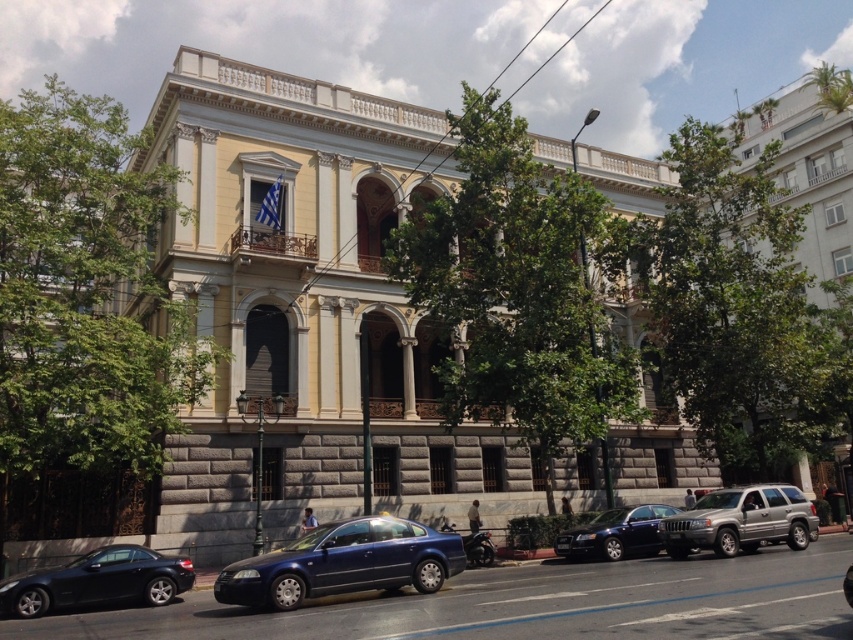
In the scene shown: Can you confirm if shiny black car at lower left is wider than shiny black sedan at center?

No.

Who is positioned more to the left, shiny black car at lower left or shiny black sedan at center?

From the viewer's perspective, shiny black car at lower left appears more on the left side.

Looking at this image, who is more forward, (68,602) or (596,550)?

Point (68,602) is in front.

Find the location of a particular element. This screenshot has height=640, width=853. shiny black car at lower left is located at coordinates (97, 580).

Who is lower down, shiny black car at lower left or silver metallic suv at center?

shiny black car at lower left

Does point (25, 572) lie in front of point (747, 490)?

Yes, point (25, 572) is in front of point (747, 490).

Identify the location of shiny black car at lower left. (97, 580).

Between glossy metallic sedan at center and silver metallic suv at center, which one is positioned higher?

silver metallic suv at center is higher up.

Who is positioned more to the right, glossy metallic sedan at center or silver metallic suv at center?

Positioned to the right is silver metallic suv at center.

What do you see at coordinates (344, 563) in the screenshot? I see `glossy metallic sedan at center` at bounding box center [344, 563].

Locate an element on the screen. The image size is (853, 640). glossy metallic sedan at center is located at coordinates (344, 563).